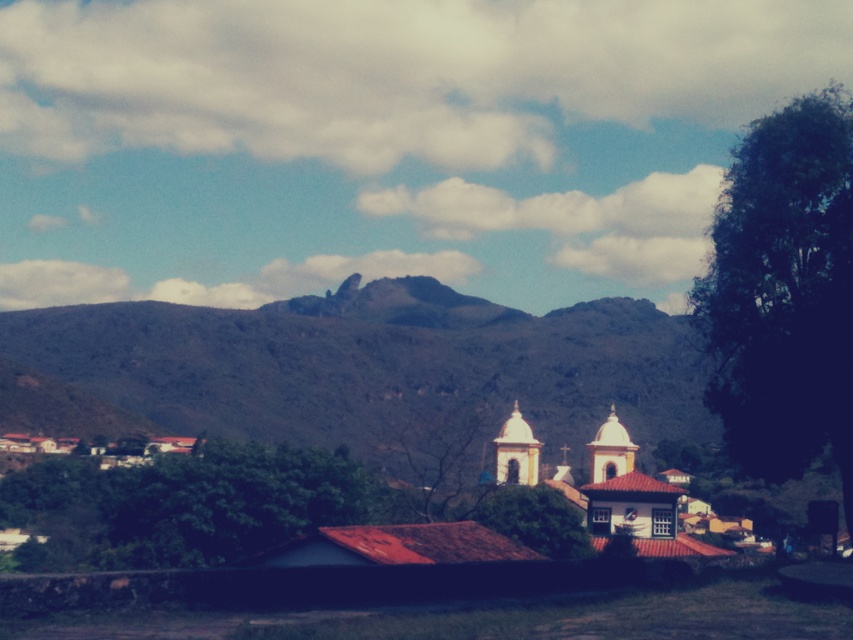
Who is shorter, green grassy mountain at center or green leafy tree at right?

green leafy tree at right is shorter.

Does green grassy mountain at center have a smaller size compared to green leafy tree at right?

No.

Which is behind, point (384, 406) or point (834, 289)?

Positioned behind is point (384, 406).

Locate an element on the screen. The image size is (853, 640). green grassy mountain at center is located at coordinates (376, 364).

Which is behind, point (769, 256) or point (682, 536)?

Point (682, 536)

Does green leafy tree at right have a lesser height compared to yellow matte church at center?

No.

Is point (822, 179) positioned after point (584, 506)?

No, (822, 179) is closer to viewer.

Where is `green leafy tree at right`? The height and width of the screenshot is (640, 853). green leafy tree at right is located at coordinates (784, 292).

Does point (585, 340) come in front of point (595, 449)?

No, it is behind (595, 449).

Locate an element on the screen. green grassy mountain at center is located at coordinates (376, 364).